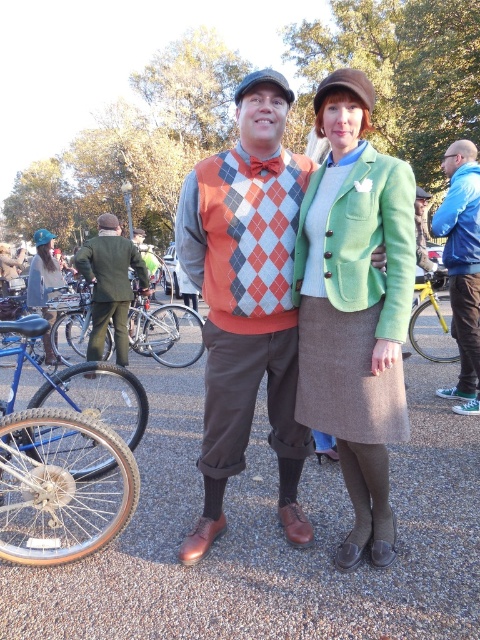
Does point (416, 339) come behind point (41, 260)?

No, (416, 339) is in front of (41, 260).

Does yellow metallic bicycle at right appear over denim jacket at left?

No, yellow metallic bicycle at right is not above denim jacket at left.

Does point (414, 326) come farther from viewer compared to point (43, 230)?

No, it is in front of (43, 230).

At what (x,y) coordinates should I click in order to perform the action: click on yellow metallic bicycle at right. Please return your answer as a coordinate pair (x, y). This screenshot has height=640, width=480. Looking at the image, I should click on (432, 320).

Does blue fabric jacket at upper right lie in front of yellow metallic bicycle at right?

Yes, blue fabric jacket at upper right is closer to the viewer.

Does point (464, 173) lie behind point (436, 353)?

No, (464, 173) is closer to viewer.

Locate an element on the screen. The height and width of the screenshot is (640, 480). blue fabric jacket at upper right is located at coordinates 463,266.

Is blue metallic bicycle at lower left thinner than blue fabric jacket at upper right?

No.

Is point (84, 435) farther from viewer compared to point (459, 413)?

That is False.

The width and height of the screenshot is (480, 640). Find the location of `blue metallic bicycle at lower left`. blue metallic bicycle at lower left is located at coordinates (82, 387).